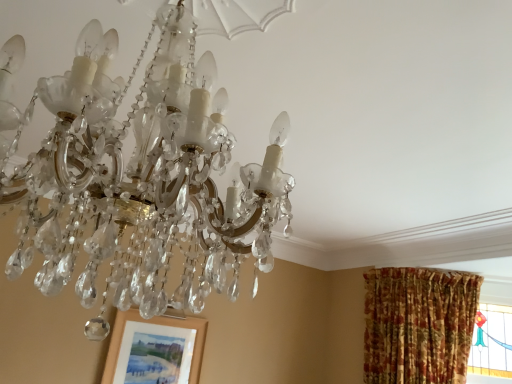
Question: Is matte wooden picture frame at lower left in front of clear crystal chandelier at upper center?

Choices:
 (A) yes
 (B) no

Answer: (B)

Question: Is matte wooden picture frame at lower left thinner than clear crystal chandelier at upper center?

Choices:
 (A) no
 (B) yes

Answer: (B)

Question: Is the depth of matte wooden picture frame at lower left greater than that of clear crystal chandelier at upper center?

Choices:
 (A) yes
 (B) no

Answer: (A)

Question: Could you tell me if matte wooden picture frame at lower left is facing clear crystal chandelier at upper center?

Choices:
 (A) no
 (B) yes

Answer: (B)

Question: From a real-world perspective, is matte wooden picture frame at lower left located beneath clear crystal chandelier at upper center?

Choices:
 (A) no
 (B) yes

Answer: (B)

Question: Is matte wooden picture frame at lower left in contact with clear crystal chandelier at upper center?

Choices:
 (A) no
 (B) yes

Answer: (A)

Question: From a real-world perspective, is clear crystal chandelier at upper center on matte wooden picture frame at lower left?

Choices:
 (A) no
 (B) yes

Answer: (B)

Question: Is clear crystal chandelier at upper center facing away from matte wooden picture frame at lower left?

Choices:
 (A) no
 (B) yes

Answer: (A)

Question: Does clear crystal chandelier at upper center have a greater width compared to matte wooden picture frame at lower left?

Choices:
 (A) no
 (B) yes

Answer: (B)

Question: Is clear crystal chandelier at upper center at the left side of matte wooden picture frame at lower left?

Choices:
 (A) yes
 (B) no

Answer: (B)

Question: Are clear crystal chandelier at upper center and matte wooden picture frame at lower left beside each other?

Choices:
 (A) yes
 (B) no

Answer: (B)

Question: Could you tell me if clear crystal chandelier at upper center is facing matte wooden picture frame at lower left?

Choices:
 (A) no
 (B) yes

Answer: (B)

Question: Considering the positions of point (198, 372) and point (133, 198), is point (198, 372) closer or farther from the camera than point (133, 198)?

Choices:
 (A) closer
 (B) farther

Answer: (B)